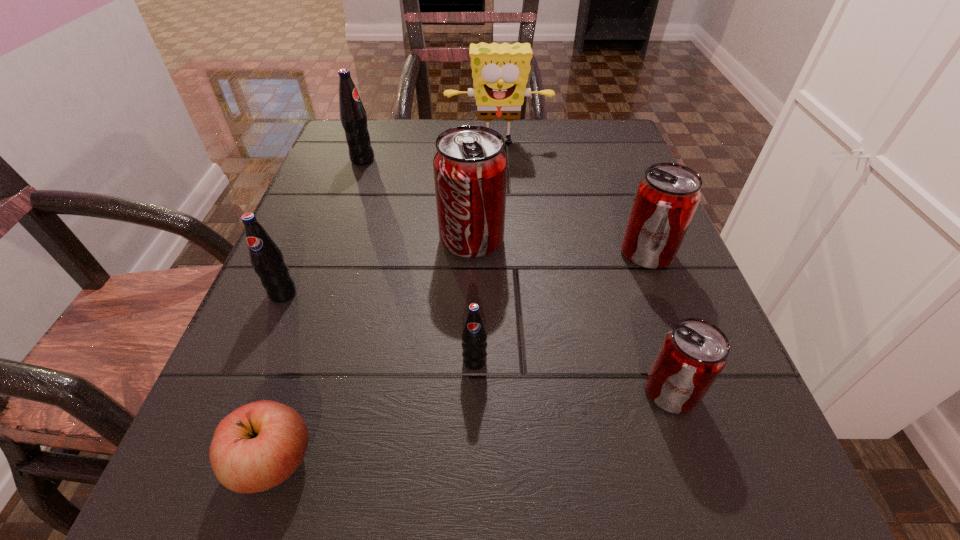
This screenshot has height=540, width=960. I want to click on vacant position in the image that satisfies the following two spatial constraints: 1. on the front label of the second farthest black pop; 2. on the left side of the shortest object, so click(213, 461).